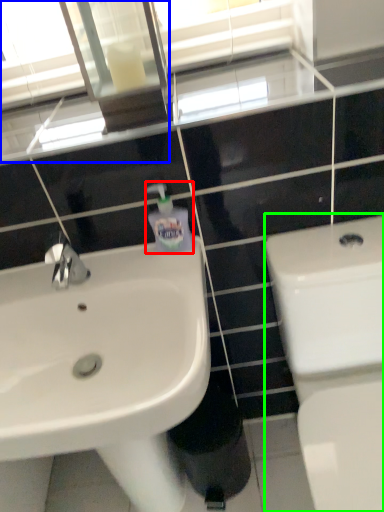
Question: Based on their relative distances, which object is farther from soap dispenser (highlighted by a red box)? Choose from mirror (highlighted by a blue box) and toilet (highlighted by a green box).

Choices:
 (A) mirror
 (B) toilet

Answer: (A)